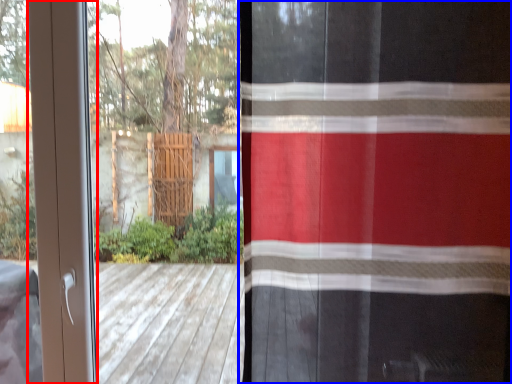
Question: Which object appears closest to the camera in this image, screen door (highlighted by a red box) or curtain (highlighted by a blue box)?

Choices:
 (A) screen door
 (B) curtain

Answer: (B)